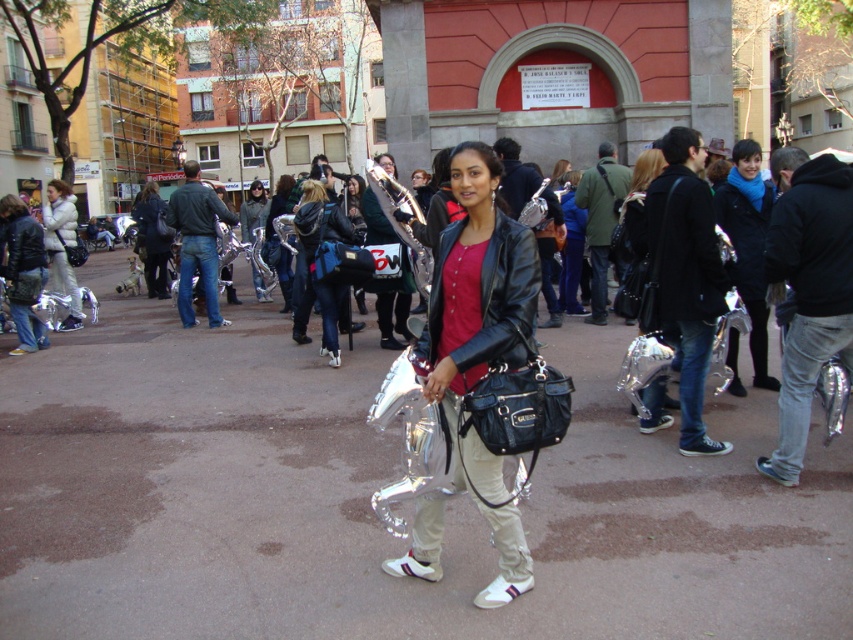
Where is the denim jacket at center located in the image?

The denim jacket at center is located at point (314, 260) in the image.

You are a photographer taking a picture of the scene. You need to focus on the person wearing the black leather jacket at right and the white puffy jacket at left. Which jacket should you adjust your camera focus on first to ensure both are in focus?

The black leather jacket at right is closer to the viewer than the white puffy jacket at left. To ensure both are in focus, you should focus on the black leather jacket at right first, as it is closer, and the depth of field will naturally include the farther object.

You are standing at point (73,198) and want to walk to the building with the red facade. Which direction should you move relative to point (663,330)?

You should move towards point (663,330), which is in front of point (73,198), to reach the building with the red facade.